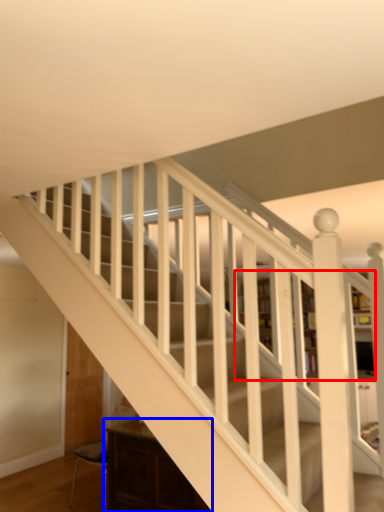
Question: Which object is closer to the camera taking this photo, bookcase (highlighted by a red box) or furniture (highlighted by a blue box)?

Choices:
 (A) bookcase
 (B) furniture

Answer: (B)